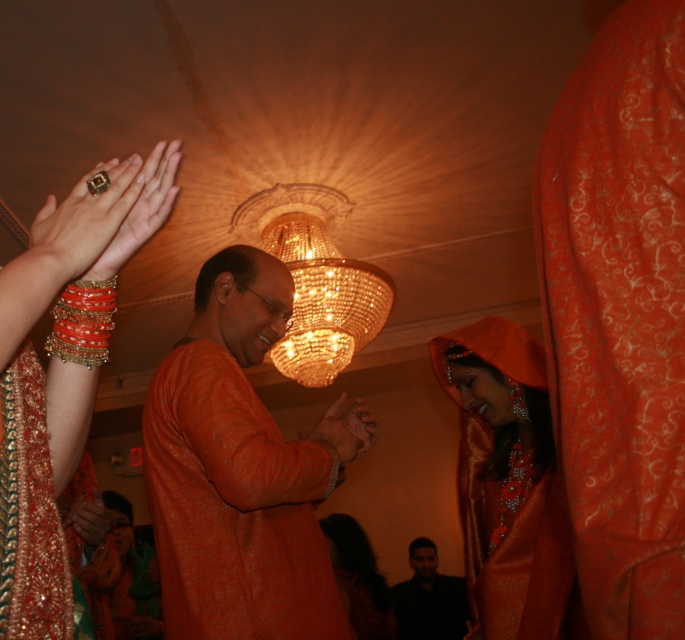
Question: Is satin orange veil at lower right bigger than crystal chandelier at center?

Choices:
 (A) yes
 (B) no

Answer: (B)

Question: Based on their relative distances, which object is farther from the gold metallic ring at upper left?

Choices:
 (A) matte gold ring at upper left
 (B) matte orange hand at center
 (C) crystal chandelier at center

Answer: (C)

Question: Among these objects, which one is farthest from the camera?

Choices:
 (A) matte orange hand at center
 (B) gold metallic ring at upper left

Answer: (A)

Question: Estimate the real-world distances between objects in this image. Which object is closer to the orange beaded bangle at upper left?

Choices:
 (A) crystal chandelier at center
 (B) black matte shirt at lower center

Answer: (A)

Question: Can you confirm if orange silk kurta at center is positioned to the right of gold metallic ring at upper left?

Choices:
 (A) no
 (B) yes

Answer: (B)

Question: Can you confirm if satin orange veil at lower right is positioned above black matte shirt at lower center?

Choices:
 (A) no
 (B) yes

Answer: (B)